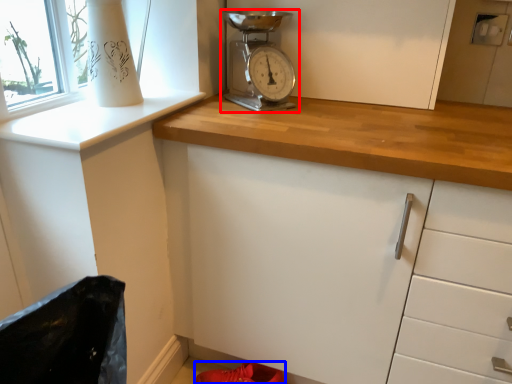
Question: Among these objects, which one is farthest to the camera, home appliance (highlighted by a red box) or footwear (highlighted by a blue box)?

Choices:
 (A) home appliance
 (B) footwear

Answer: (B)